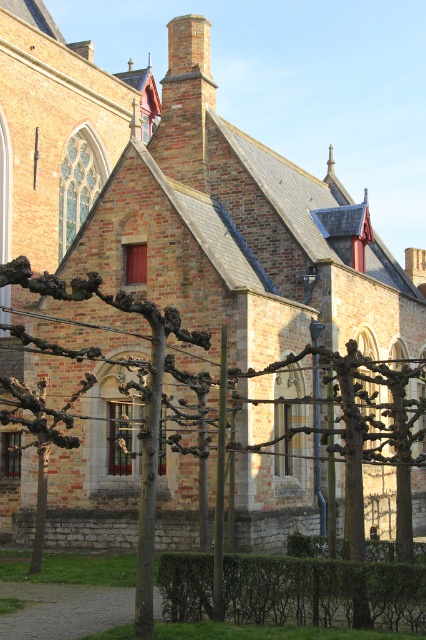
You are a gardener planning to transplant both the green leafy hedge at lower center and the bare branches at center to a new garden plot. The plot has limited space. Based on the current sizes, which of the two would require more space in the new plot?

The bare branches at center would require more space in the new plot because the green leafy hedge at lower center occupies less space than the bare branches at center.

Consider the image. You are a gardener who needs to water the green leafy hedge at lower center and the bare branches at center. The watering can you have can only reach 10 meters. Can you water both without moving the can?

The green leafy hedge at lower center is 14.19 meters from the bare branches at center, which is beyond the 10 meter reach of the watering can. Therefore, you cannot water both without moving the can.

Based on the photo, based on the scene description, which object is taller between the green leafy hedge at lower center and the bare branches at center?

The bare branches at center are taller than the green leafy hedge at lower center.